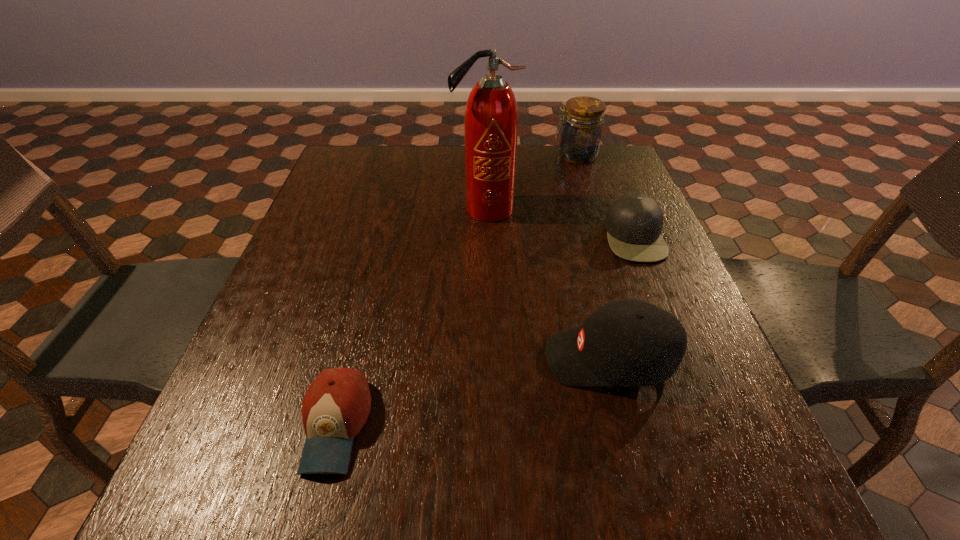
What are the coordinates of `vacant region located on the lid of the second tallest object` in the screenshot? It's located at click(x=428, y=156).

Identify the location of vacant point located 0.340m on the lid of the second tallest object. The image size is (960, 540). (444, 156).

I want to click on vacant position located 0.350m on the lid of the second tallest object, so click(x=441, y=156).

Where is `free point located with a logo on the front of the taller baseball cap`? free point located with a logo on the front of the taller baseball cap is located at coordinates (502, 358).

In order to click on blank space located 0.310m with a logo on the front of the taller baseball cap in this screenshot , I will do click(379, 358).

Find the location of a particular element. This screenshot has width=960, height=540. vacant position located with a logo on the front of the taller baseball cap is located at coordinates (496, 358).

Find the location of a particular element. vacant region located on the brim of the cap is located at coordinates (545, 237).

Image resolution: width=960 pixels, height=540 pixels. I want to click on free region located 0.230m on the brim of the cap, so click(x=513, y=237).

Where is `vacant space located 0.180m on the brim of the cap`? The height and width of the screenshot is (540, 960). vacant space located 0.180m on the brim of the cap is located at coordinates (533, 237).

This screenshot has width=960, height=540. I want to click on free spot located on the front-facing side of the shortest object, so pos(313,515).